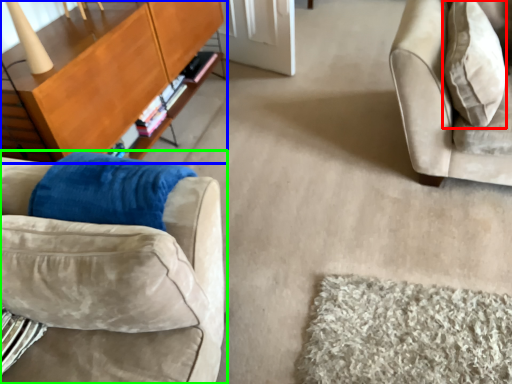
Question: Which object is the farthest from throw pillow (highlighted by a red box)? Choose among these: table (highlighted by a blue box) or studio couch (highlighted by a green box).

Choices:
 (A) table
 (B) studio couch

Answer: (A)